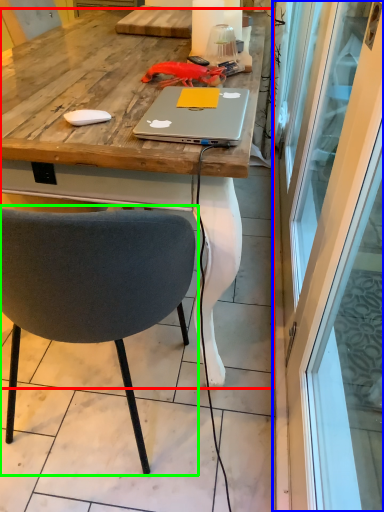
Question: Estimate the real-world distances between objects in this image. Which object is farther from desk (highlighted by a red box), screen door (highlighted by a blue box) or chair (highlighted by a green box)?

Choices:
 (A) screen door
 (B) chair

Answer: (A)